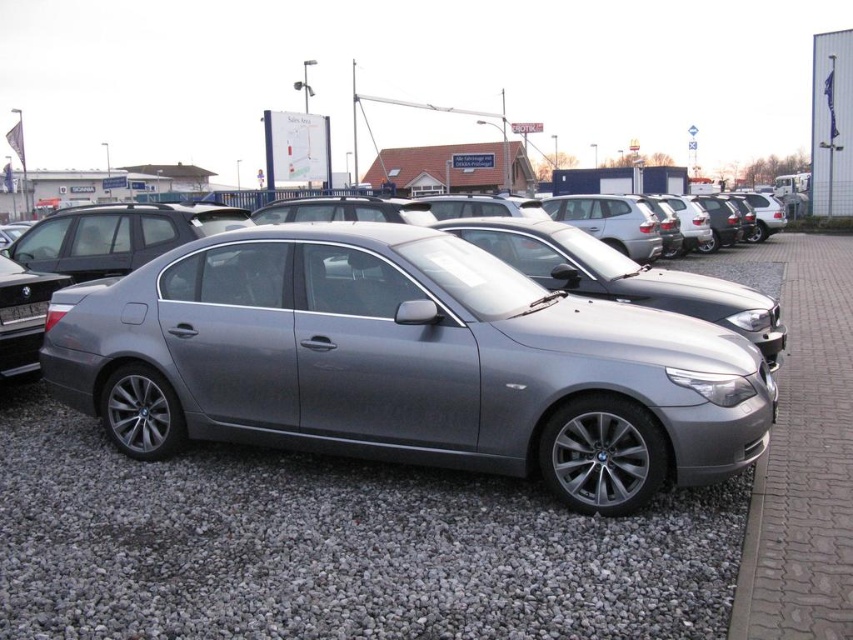
Question: Does satin metallic sedan at center appear over gray gravel at center?

Choices:
 (A) yes
 (B) no

Answer: (A)

Question: Which object is farther from the camera taking this photo?

Choices:
 (A) satin metallic sedan at center
 (B) gray gravel at center

Answer: (A)

Question: Is satin metallic sedan at center positioned before gray gravel at center?

Choices:
 (A) no
 (B) yes

Answer: (A)

Question: Which of the following is the closest to the observer?

Choices:
 (A) gray gravel at center
 (B) satin metallic sedan at center

Answer: (A)

Question: Does satin metallic sedan at center appear under gray gravel at center?

Choices:
 (A) yes
 (B) no

Answer: (B)